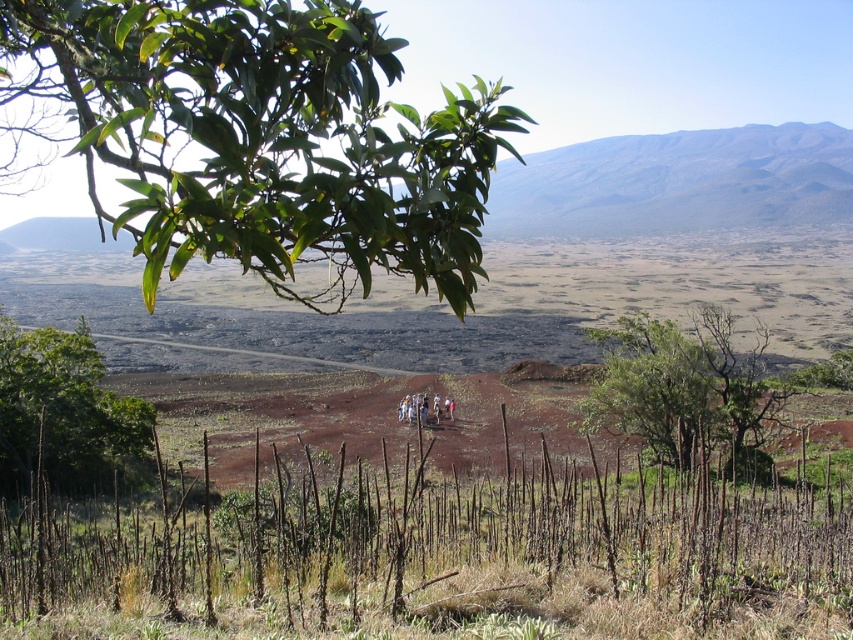
Question: Is green glossy leaves at upper left above green leafy tree at center?

Choices:
 (A) yes
 (B) no

Answer: (A)

Question: Among these objects, which one is farthest from the camera?

Choices:
 (A) green glossy leaves at upper left
 (B) green leafy tree at center

Answer: (B)

Question: Which object appears farthest from the camera in this image?

Choices:
 (A) green leafy tree at center
 (B) green glossy leaves at upper left

Answer: (A)

Question: Is green leafy tree at center closer to the viewer compared to green leafy tree at lower left?

Choices:
 (A) no
 (B) yes

Answer: (B)

Question: Does green leafy tree at center appear on the left side of green leafy tree at lower left?

Choices:
 (A) no
 (B) yes

Answer: (A)

Question: Considering the real-world distances, which object is farthest from the green leafy tree at center?

Choices:
 (A) green glossy leaves at upper left
 (B) green leafy tree at lower left

Answer: (B)